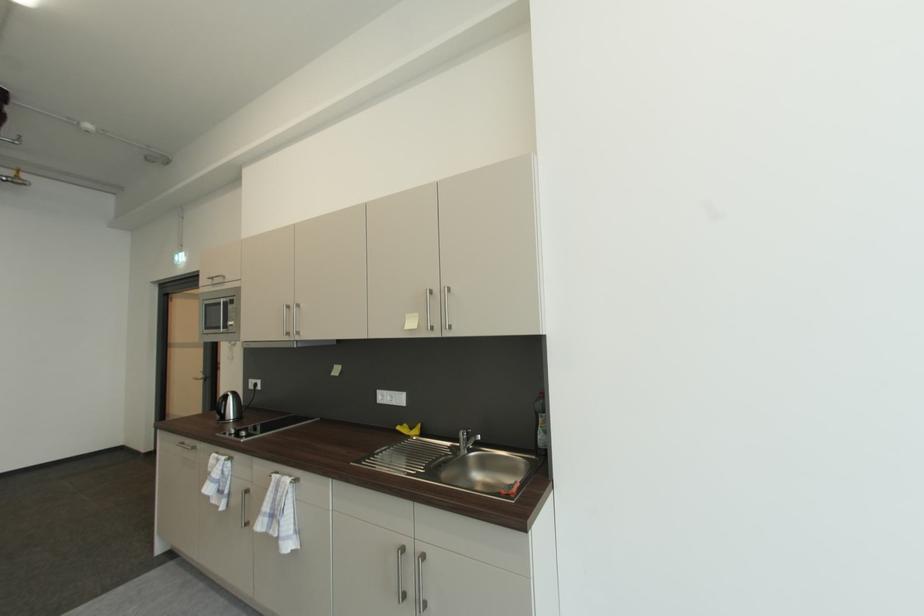
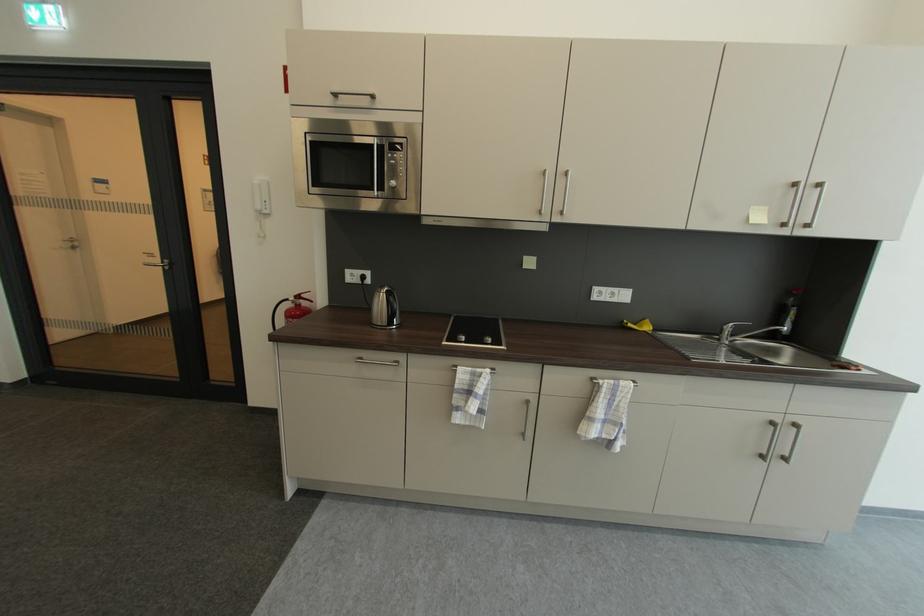
The point at (233,329) is marked in the first image. Where is the corresponding point in the second image?

(387, 188)